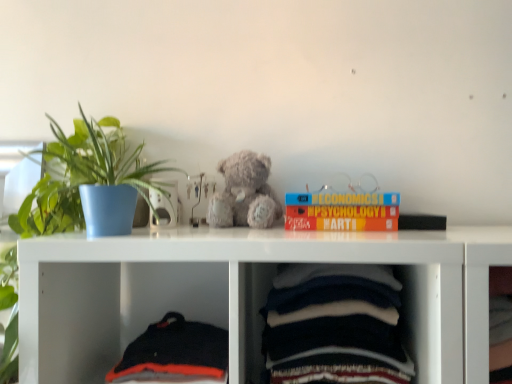
Locate an element on the screen. black matte book at upper right, which is counted as the 2th book, starting from the left is located at coordinates (421, 222).

The image size is (512, 384). In order to click on green leafy plant in blue pot at left in this screenshot , I will do `click(87, 182)`.

Measure the distance between point (212,362) and camera.

A distance of 32.13 inches exists between point (212,362) and camera.

Measure the distance between point (289, 350) and camera.

32.44 inches.

Locate an element on the screen. This screenshot has width=512, height=384. dark blue cotton baby clothes at lower center, the 2th baby clothe positioned from the left is located at coordinates (334, 326).

The width and height of the screenshot is (512, 384). What are the coordinates of `hardcover book at upper center, the 1th book in the left-to-right sequence` in the screenshot? It's located at (342, 211).

From a real-world perspective, is green leafy plant in blue pot at left positioned above or below dark blue cotton baby clothes at lower center, the 2th baby clothe positioned from the left?

From a real-world perspective, green leafy plant in blue pot at left is physically above dark blue cotton baby clothes at lower center, the 2th baby clothe positioned from the left.

Starting from the green leafy plant in blue pot at left, which baby clothe is the 2nd one to the right? Please provide its 2D coordinates.

[(334, 326)]

From the image's perspective, is green leafy plant in blue pot at left located above dark blue cotton baby clothes at lower center, the first baby clothe positioned from the right?

Yes.

Does green leafy plant in blue pot at left appear on the right side of dark blue cotton baby clothes at lower center, the first baby clothe positioned from the right?

No.

Is point (287, 202) in front of point (220, 168)?

Yes, it is in front of point (220, 168).

Is hardcover book at upper center, the 1th book in the left-to-right sequence, placed right next to fuzzy gray teddy bear at center?

No, hardcover book at upper center, the 1th book in the left-to-right sequence, is not touching fuzzy gray teddy bear at center.

Considering the positions of objects hardcover book at upper center, the second book in the right-to-left sequence, and fuzzy gray teddy bear at center in the image provided, who is in front, hardcover book at upper center, the second book in the right-to-left sequence, or fuzzy gray teddy bear at center?

hardcover book at upper center, the second book in the right-to-left sequence.

From a real-world perspective, relative to fuzzy gray teddy bear at center, is hardcover book at upper center, the 1th book in the left-to-right sequence, vertically above or below?

From a real-world perspective, hardcover book at upper center, the 1th book in the left-to-right sequence, is physically below fuzzy gray teddy bear at center.

From a real-world perspective, between fuzzy gray teddy bear at center and green leafy plant in blue pot at left, who is vertically lower?

fuzzy gray teddy bear at center.

Can you confirm if fuzzy gray teddy bear at center is shorter than green leafy plant in blue pot at left?

Yes.

Based on the photo, does fuzzy gray teddy bear at center lie in front of green leafy plant in blue pot at left?

No, it is not.

From the image's perspective, is fuzzy gray teddy bear at center positioned above or below green leafy plant in blue pot at left?

Clearly, from the image's perspective, fuzzy gray teddy bear at center is below green leafy plant in blue pot at left.

Is hardcover book at upper center, the 1th book in the left-to-right sequence, taller or shorter than dark blue cotton baby clothes at lower center, the first baby clothe positioned from the right?

Considering their sizes, hardcover book at upper center, the 1th book in the left-to-right sequence, has less height than dark blue cotton baby clothes at lower center, the first baby clothe positioned from the right.

Does hardcover book at upper center, the 1th book in the left-to-right sequence, touch dark blue cotton baby clothes at lower center, the 2th baby clothe positioned from the left?

No, hardcover book at upper center, the 1th book in the left-to-right sequence, is not in contact with dark blue cotton baby clothes at lower center, the 2th baby clothe positioned from the left.

Is hardcover book at upper center, the 1th book in the left-to-right sequence, oriented towards dark blue cotton baby clothes at lower center, the first baby clothe positioned from the right?

No, hardcover book at upper center, the 1th book in the left-to-right sequence, is not turned towards dark blue cotton baby clothes at lower center, the first baby clothe positioned from the right.

Based on their positions, is hardcover book at upper center, the 1th book in the left-to-right sequence, located to the left or right of dark blue cotton baby clothes at lower center, the first baby clothe positioned from the right?

Clearly, hardcover book at upper center, the 1th book in the left-to-right sequence, is on the right of dark blue cotton baby clothes at lower center, the first baby clothe positioned from the right, in the image.

From the image's perspective, which is above, dark blue cotton baby clothes at lower center, the first baby clothe positioned from the right, or hardcover book at upper center, the second book in the right-to-left sequence?

hardcover book at upper center, the second book in the right-to-left sequence.

Which object is further away from the camera, dark blue cotton baby clothes at lower center, the 2th baby clothe positioned from the left, or hardcover book at upper center, the second book in the right-to-left sequence?

hardcover book at upper center, the second book in the right-to-left sequence, is more distant.

Does dark blue cotton baby clothes at lower center, the 2th baby clothe positioned from the left, have a greater height compared to hardcover book at upper center, the second book in the right-to-left sequence?

Yes, dark blue cotton baby clothes at lower center, the 2th baby clothe positioned from the left, is taller than hardcover book at upper center, the second book in the right-to-left sequence.

From the image's perspective, is green leafy plant in blue pot at left located above fuzzy gray teddy bear at center?

Yes, from the image's perspective, green leafy plant in blue pot at left is over fuzzy gray teddy bear at center.

Is green leafy plant in blue pot at left turned away from fuzzy gray teddy bear at center?

That's not correct — green leafy plant in blue pot at left is not looking away from fuzzy gray teddy bear at center.

Is green leafy plant in blue pot at left further to the viewer compared to fuzzy gray teddy bear at center?

No.

Between green leafy plant in blue pot at left and fuzzy gray teddy bear at center, which one appears on the left side from the viewer's perspective?

From the viewer's perspective, green leafy plant in blue pot at left appears more on the left side.

Between fuzzy gray teddy bear at center and black cotton sweater at lower left, the first baby clothe positioned from the left, which one has less height?

With less height is black cotton sweater at lower left, the first baby clothe positioned from the left.

Looking at the image, does fuzzy gray teddy bear at center seem bigger or smaller compared to black cotton sweater at lower left, the first baby clothe positioned from the left?

Clearly, fuzzy gray teddy bear at center is smaller in size than black cotton sweater at lower left, the first baby clothe positioned from the left.

Is fuzzy gray teddy bear at center completely or partially outside of black cotton sweater at lower left, the 2th baby clothe viewed from the right?

fuzzy gray teddy bear at center is positioned outside black cotton sweater at lower left, the 2th baby clothe viewed from the right.

In the scene shown: Which object is positioned more to the right, fuzzy gray teddy bear at center or black cotton sweater at lower left, the 2th baby clothe viewed from the right?

fuzzy gray teddy bear at center.

I want to click on the 1st baby clothe below the green leafy plant in blue pot at left (from the image's perspective), so click(334, 326).

From the fuzzy gray teddy bear at center, count 1st books forward and point to it. Please provide its 2D coordinates.

[(342, 211)]

From the image, which object appears to be nearer to hardcover book at upper center, the second book in the right-to-left sequence, green leafy plant in blue pot at left or black cotton sweater at lower left, the 2th baby clothe viewed from the right?

Among the two, black cotton sweater at lower left, the 2th baby clothe viewed from the right, is located nearer to hardcover book at upper center, the second book in the right-to-left sequence.

Estimate the real-world distances between objects in this image. Which object is closer to dark blue cotton baby clothes at lower center, the first baby clothe positioned from the right, black cotton sweater at lower left, the 2th baby clothe viewed from the right, or black matte book at upper right, which is counted as the 2th book, starting from the left?

The object closer to dark blue cotton baby clothes at lower center, the first baby clothe positioned from the right, is black cotton sweater at lower left, the 2th baby clothe viewed from the right.

When comparing their distances from green leafy plant in blue pot at left, does fuzzy gray teddy bear at center or black cotton sweater at lower left, the 2th baby clothe viewed from the right, seem further?

black cotton sweater at lower left, the 2th baby clothe viewed from the right, is positioned further to the anchor green leafy plant in blue pot at left.

From the image, which object appears to be farther from fuzzy gray teddy bear at center, dark blue cotton baby clothes at lower center, the 2th baby clothe positioned from the left, or black cotton sweater at lower left, the first baby clothe positioned from the left?

black cotton sweater at lower left, the first baby clothe positioned from the left, is positioned further to the anchor fuzzy gray teddy bear at center.

From the image, which object appears to be nearer to hardcover book at upper center, the second book in the right-to-left sequence, fuzzy gray teddy bear at center or black cotton sweater at lower left, the 2th baby clothe viewed from the right?

fuzzy gray teddy bear at center.

Consider the image. Considering their positions, is black matte book at upper right, which is counted as the 2th book, starting from the left, positioned further to black cotton sweater at lower left, the 2th baby clothe viewed from the right, than fuzzy gray teddy bear at center?

black matte book at upper right, which is counted as the 2th book, starting from the left, lies further to black cotton sweater at lower left, the 2th baby clothe viewed from the right, than the other object.

When comparing their distances from hardcover book at upper center, the 1th book in the left-to-right sequence, does black matte book at upper right, marked as the first book in a right-to-left arrangement, or dark blue cotton baby clothes at lower center, the 2th baby clothe positioned from the left, seem closer?

black matte book at upper right, marked as the first book in a right-to-left arrangement, lies closer to hardcover book at upper center, the 1th book in the left-to-right sequence, than the other object.

Estimate the real-world distances between objects in this image. Which object is further from fuzzy gray teddy bear at center, black cotton sweater at lower left, the first baby clothe positioned from the left, or black matte book at upper right, marked as the first book in a right-to-left arrangement?

Based on the image, black matte book at upper right, marked as the first book in a right-to-left arrangement, appears to be further to fuzzy gray teddy bear at center.

Identify the location of book between black cotton sweater at lower left, the first baby clothe positioned from the left, and black matte book at upper right, which is counted as the 2th book, starting from the left, from left to right. (342, 211).

You are a GUI agent. You are given a task and a screenshot of the screen. Output one action in this format:
    pyautogui.click(x=<x>, y=<y>)
    Task: Click on the book that lies between hardcover book at upper center, the 1th book in the left-to-right sequence, and dark blue cotton baby clothes at lower center, the 2th baby clothe positioned from the left, from top to bottom
    This screenshot has height=384, width=512.
    Given the screenshot: What is the action you would take?
    pyautogui.click(x=421, y=222)

This screenshot has width=512, height=384. Find the location of `teddy bear located between black cotton sweater at lower left, the first baby clothe positioned from the left, and black matte book at upper right, which is counted as the 2th book, starting from the left, in the left-right direction`. teddy bear located between black cotton sweater at lower left, the first baby clothe positioned from the left, and black matte book at upper right, which is counted as the 2th book, starting from the left, in the left-right direction is located at coordinates (244, 193).

Identify the location of teddy bear between green leafy plant in blue pot at left and black cotton sweater at lower left, the 2th baby clothe viewed from the right, from top to bottom. (244, 193).